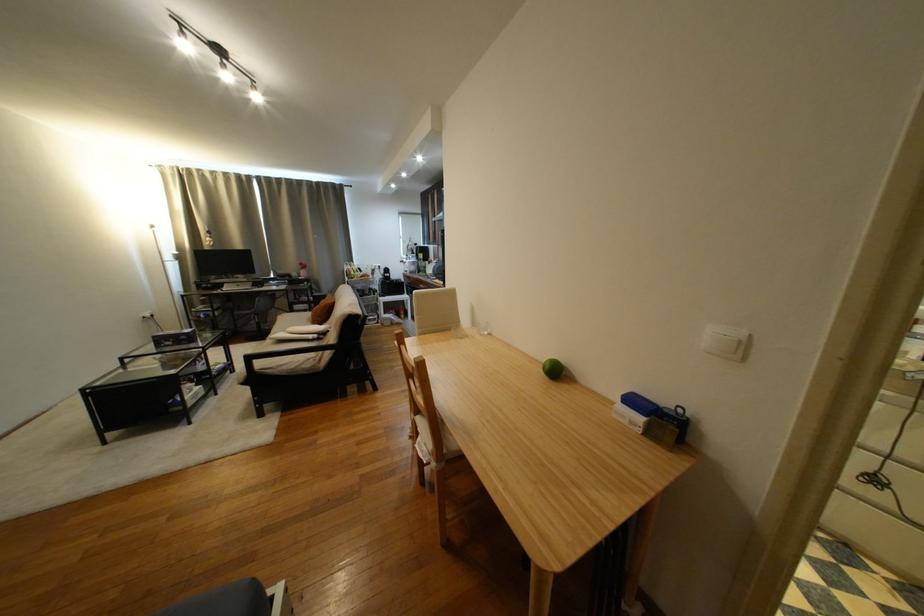
What do you see at coordinates (725, 342) in the screenshot?
I see `the white light switch` at bounding box center [725, 342].